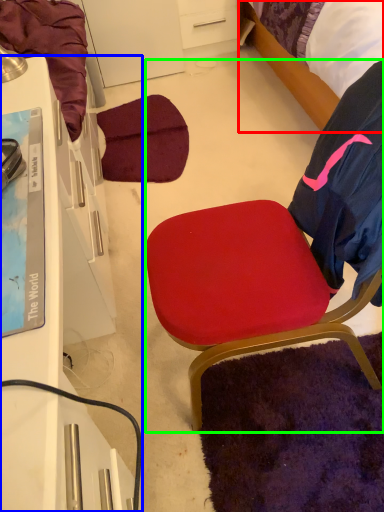
Question: Which is nearer to the bed (highlighted by a red box)? desk (highlighted by a blue box) or chair (highlighted by a green box).

Choices:
 (A) desk
 (B) chair

Answer: (B)